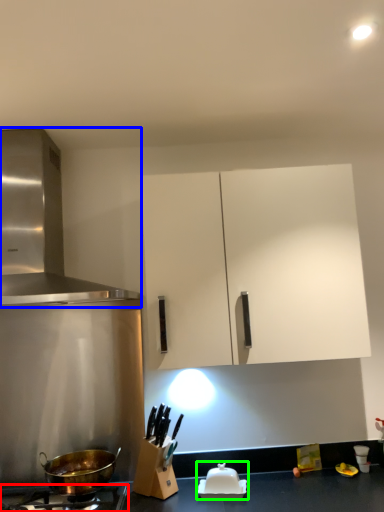
Question: Based on their relative distances, which object is nearer to gas stove (highlighted by a red box)? Choose from kitchen appliance (highlighted by a blue box) and appliance (highlighted by a green box).

Choices:
 (A) kitchen appliance
 (B) appliance

Answer: (B)